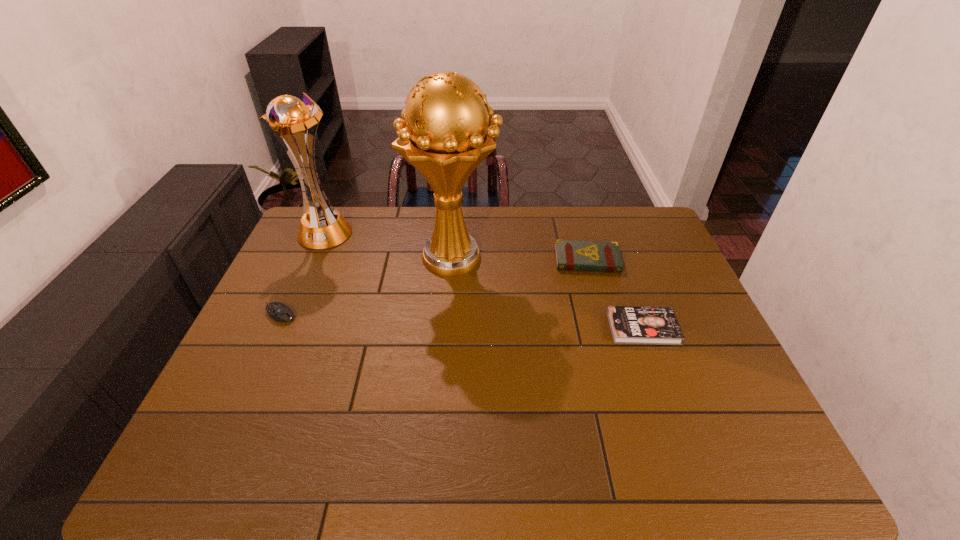
Select which object is the second closest to the farther book. Please provide its 2D coordinates. Your answer should be formatted as a tuple, i.e. [(x, y)], where the tuple contains the x and y coordinates of a point satisfying the conditions above.

[(447, 136)]

At what (x,y) coordinates should I click in order to perform the action: click on object that is the third closest one to the left trophy. Please return your answer as a coordinate pair (x, y). Looking at the image, I should click on (572, 255).

The height and width of the screenshot is (540, 960). Identify the location of blank space that satisfies the following two spatial constraints: 1. on the front side of the shortest object; 2. on the right side of the computer mouse. (273, 328).

You are a GUI agent. You are given a task and a screenshot of the screen. Output one action in this format:
    pyautogui.click(x=<x>, y=<y>)
    Task: Click on the vacant region that satisfies the following two spatial constraints: 1. at the front of the farther book where the globe is prominent; 2. on the right side of the right trophy
    Image resolution: width=960 pixels, height=540 pixels.
    Given the screenshot: What is the action you would take?
    pyautogui.click(x=454, y=260)

In order to click on blank area in the image that satisfies the following two spatial constraints: 1. on the front side of the nearer book; 2. on the right side of the computer mouse in this screenshot , I will do `click(273, 328)`.

Where is `free space that satisfies the following two spatial constraints: 1. on the back side of the shortest object; 2. at the front of the taller trophy where the globe is prominent`? The height and width of the screenshot is (540, 960). free space that satisfies the following two spatial constraints: 1. on the back side of the shortest object; 2. at the front of the taller trophy where the globe is prominent is located at coordinates (616, 256).

The width and height of the screenshot is (960, 540). Find the location of `free spot that satisfies the following two spatial constraints: 1. at the front of the farther book where the globe is prominent; 2. on the left side of the taller trophy`. free spot that satisfies the following two spatial constraints: 1. at the front of the farther book where the globe is prominent; 2. on the left side of the taller trophy is located at coordinates (454, 260).

I want to click on blank area in the image that satisfies the following two spatial constraints: 1. at the front of the right trophy where the globe is prominent; 2. on the back side of the farther book, so click(454, 260).

Where is `vacant area that satisfies the following two spatial constraints: 1. at the front of the taller book where the globe is prominent; 2. on the right side of the right trophy`? vacant area that satisfies the following two spatial constraints: 1. at the front of the taller book where the globe is prominent; 2. on the right side of the right trophy is located at coordinates (454, 260).